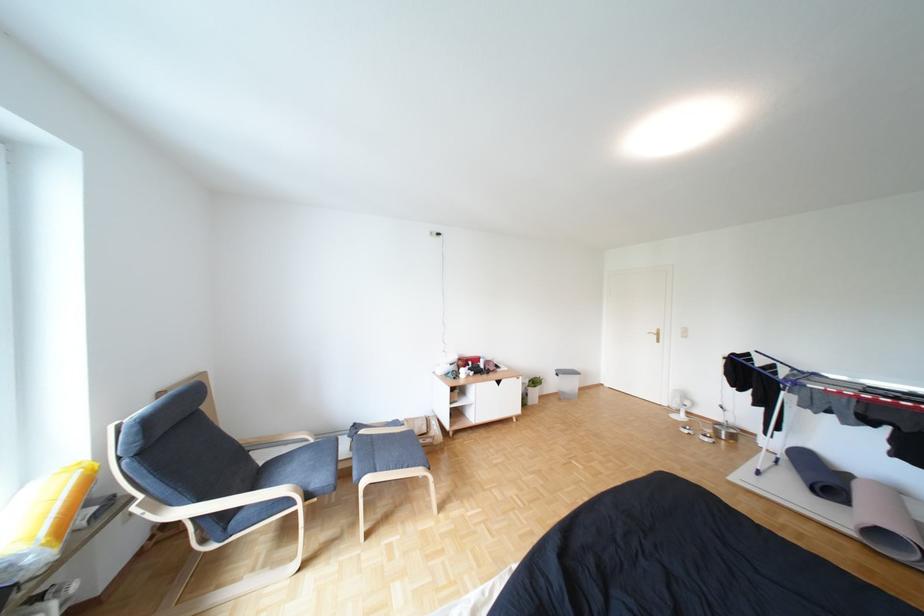
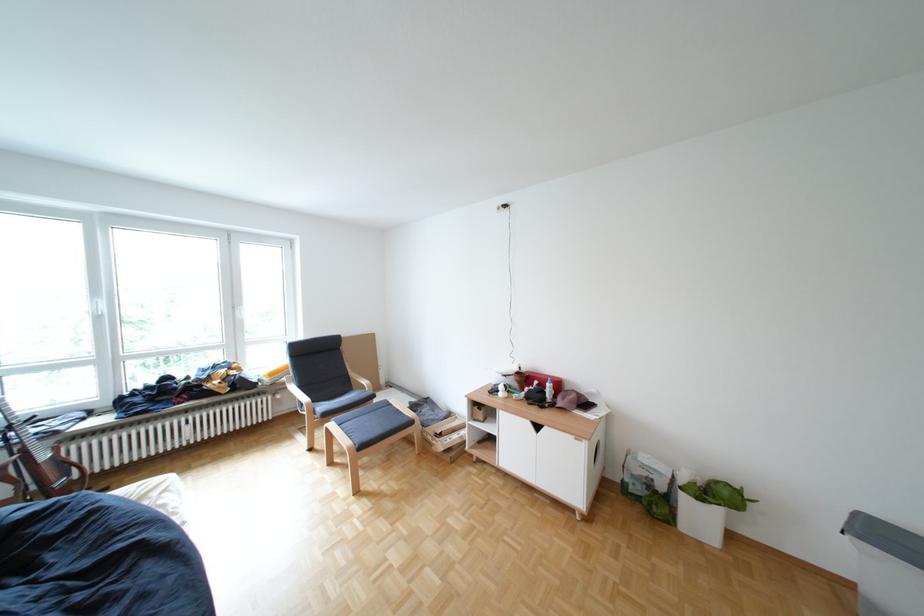
Where in the second image is the point corresponding to point (485, 363) from the first image?

(552, 383)